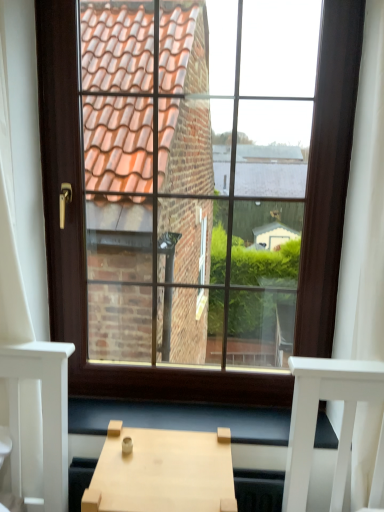
Question: From a real-world perspective, is wooden at lower center physically above brown wooden window at center?

Choices:
 (A) no
 (B) yes

Answer: (A)

Question: Does wooden at lower center turn towards brown wooden window at center?

Choices:
 (A) no
 (B) yes

Answer: (A)

Question: Can you see wooden at lower center touching brown wooden window at center?

Choices:
 (A) yes
 (B) no

Answer: (B)

Question: Is wooden at lower center far away from brown wooden window at center?

Choices:
 (A) no
 (B) yes

Answer: (A)

Question: Can you confirm if wooden at lower center is positioned to the left of brown wooden window at center?

Choices:
 (A) no
 (B) yes

Answer: (A)

Question: From a real-world perspective, is wooden at lower center positioned under brown wooden window at center based on gravity?

Choices:
 (A) no
 (B) yes

Answer: (B)

Question: Is wooden at lower center to the right of light wood table at center from the viewer's perspective?

Choices:
 (A) no
 (B) yes

Answer: (B)

Question: Is light wood table at center at the back of wooden at lower center?

Choices:
 (A) yes
 (B) no

Answer: (A)

Question: From a real-world perspective, is wooden at lower center located higher than light wood table at center?

Choices:
 (A) yes
 (B) no

Answer: (A)

Question: Is wooden at lower center not within light wood table at center?

Choices:
 (A) yes
 (B) no

Answer: (A)

Question: Considering the relative sizes of wooden at lower center and light wood table at center in the image provided, is wooden at lower center thinner than light wood table at center?

Choices:
 (A) no
 (B) yes

Answer: (B)

Question: Is wooden at lower center in contact with light wood table at center?

Choices:
 (A) no
 (B) yes

Answer: (A)

Question: From a real-world perspective, is brown wooden window at center over light wood table at center?

Choices:
 (A) no
 (B) yes

Answer: (B)